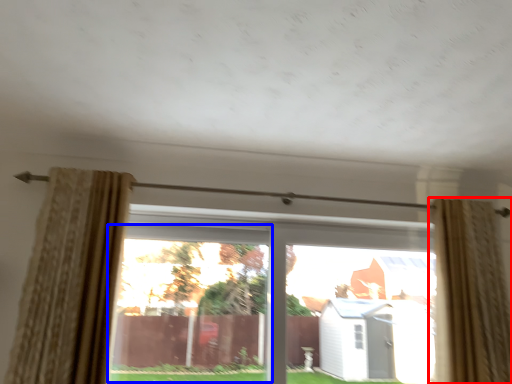
Question: Among these objects, which one is farthest to the camera, curtain (highlighted by a red box) or window (highlighted by a blue box)?

Choices:
 (A) curtain
 (B) window

Answer: (B)